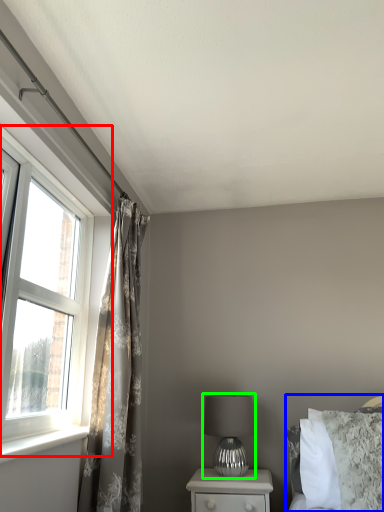
Question: Which object is the farthest from window (highlighted by a red box)? Choose among these: bed (highlighted by a blue box) or table lamp (highlighted by a green box).

Choices:
 (A) bed
 (B) table lamp

Answer: (A)